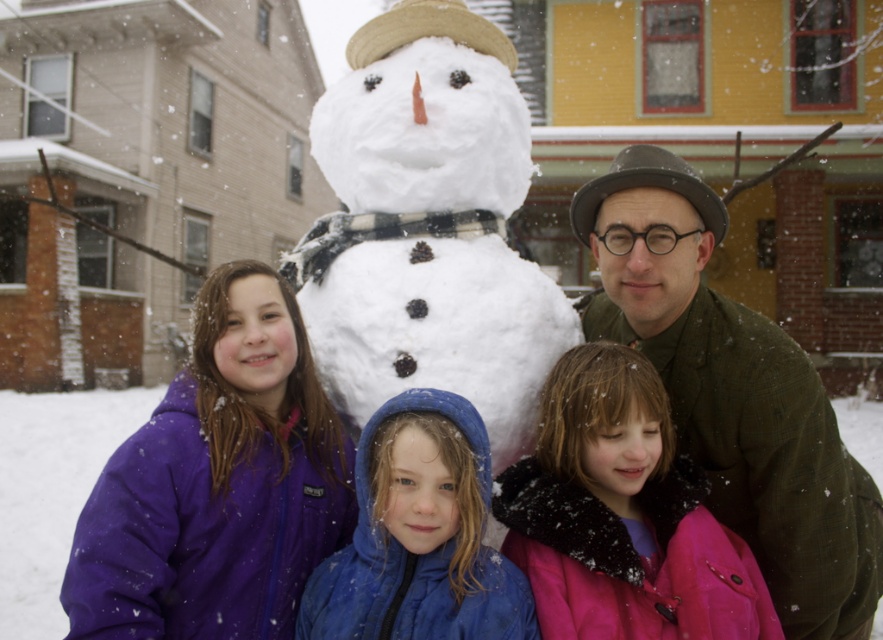
Question: Which point appears farthest from the camera in this image?

Choices:
 (A) (87, 628)
 (B) (436, 403)

Answer: (B)

Question: Which object is positioned closest to the white fluffy snowman at center?

Choices:
 (A) blue fleece jacket at center
 (B) pink fur-trimmed coat at lower right

Answer: (B)

Question: Does green woolen coat at center have a larger size compared to blue fleece jacket at center?

Choices:
 (A) yes
 (B) no

Answer: (A)

Question: Which of these objects is positioned closest to the purple fleece jacket at lower left?

Choices:
 (A) white fluffy snowman at center
 (B) blue fleece jacket at center
 (C) green woolen coat at center

Answer: (B)

Question: Does purple fleece jacket at lower left appear over blue fleece jacket at center?

Choices:
 (A) no
 (B) yes

Answer: (B)

Question: Is white fluffy snowman at center further to the viewer compared to purple fleece jacket at lower left?

Choices:
 (A) yes
 (B) no

Answer: (A)